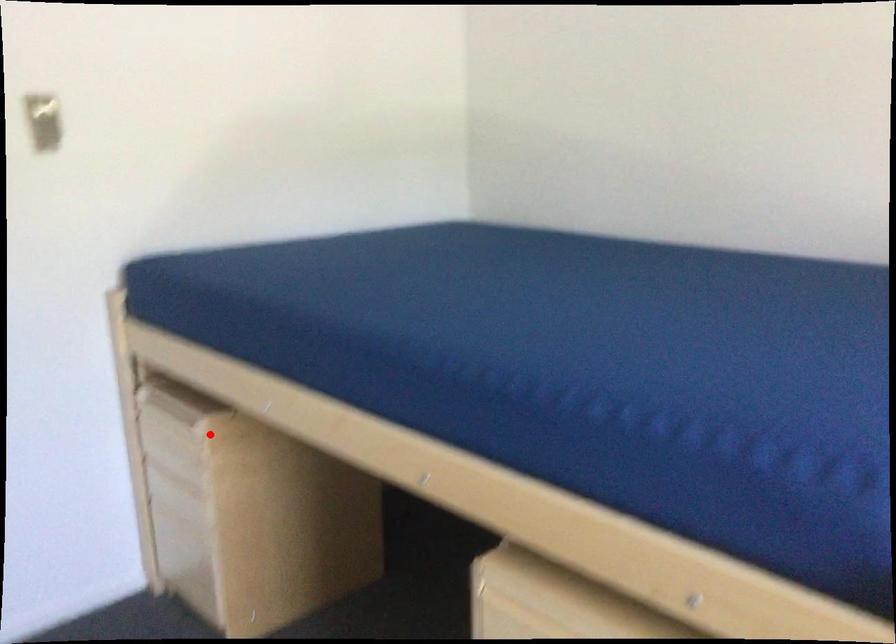
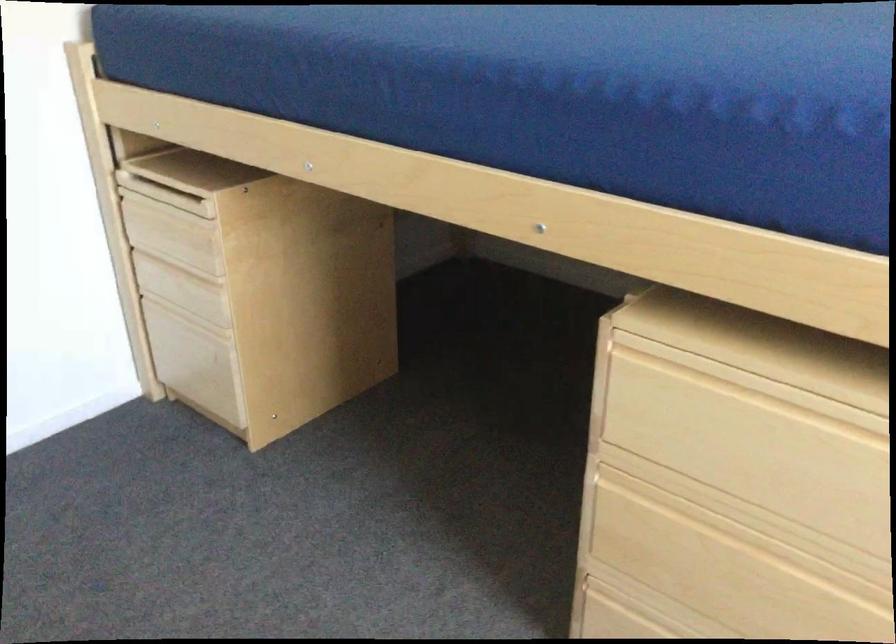
Question: A red point is marked in image1. In image2, is the corresponding 3D point closer to the camera or farther? Reply with the corresponding letter.

Choices:
 (A) The corresponding 3D point is closer.
 (B) The corresponding 3D point is farther.

Answer: (A)